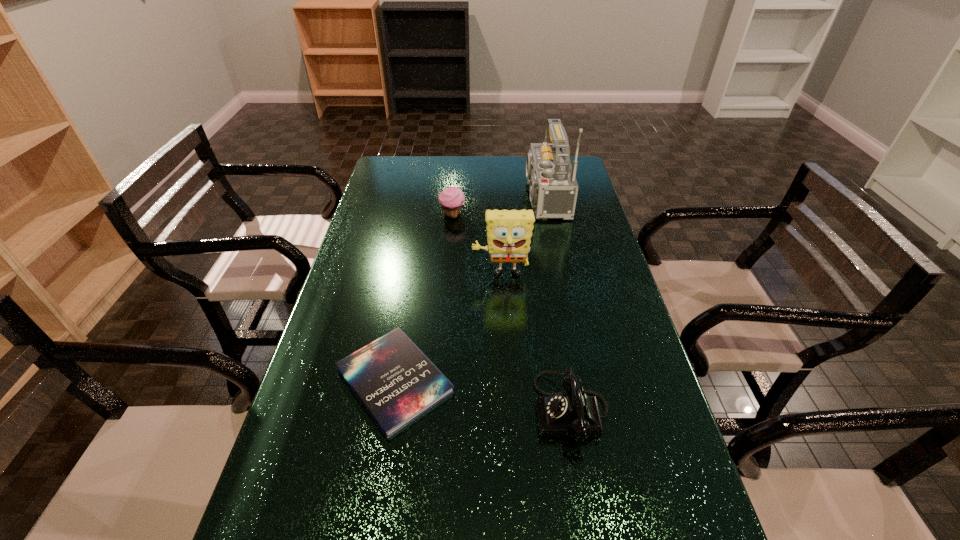
Where is `blank area located on the left of the cupcake`? The image size is (960, 540). blank area located on the left of the cupcake is located at coordinates (396, 215).

Find the location of a particular element. The image size is (960, 540). blank space located 0.290m on the dial of the telephone is located at coordinates (409, 410).

At what (x,y) coordinates should I click in order to perform the action: click on vacant region located on the dial of the telephone. Please return your answer as a coordinate pair (x, y). This screenshot has width=960, height=540. Looking at the image, I should click on (360, 410).

Where is `vacant position located 0.150m on the dial of the telephone`? The image size is (960, 540). vacant position located 0.150m on the dial of the telephone is located at coordinates (469, 410).

This screenshot has height=540, width=960. In order to click on vacant space located on the back of the hardback book in this screenshot , I will do `click(405, 314)`.

Locate an element on the screen. object located at the far edge is located at coordinates (553, 186).

Locate an element on the screen. The image size is (960, 540). object located in the left edge section of the desktop is located at coordinates click(x=393, y=379).

Where is `radio receiver at the right edge`? radio receiver at the right edge is located at coordinates (553, 186).

This screenshot has height=540, width=960. In order to click on telephone positioned at the right edge in this screenshot , I will do `click(572, 413)`.

Locate an element on the screen. The height and width of the screenshot is (540, 960). object located in the far right corner section of the desktop is located at coordinates (553, 186).